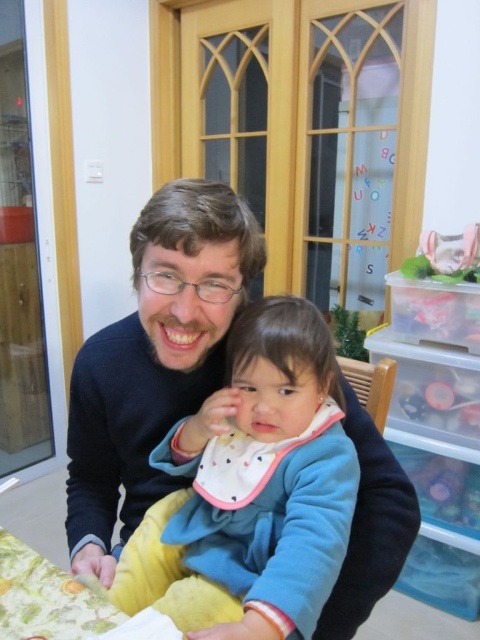
You are organizing a small party and need to place a decorative centerpiece on the table. Which object should you place it on, the blue fleece jacket at center or the floral fabric table at lower left?

The floral fabric table at lower left is the appropriate surface for placing the decorative centerpiece since the blue fleece jacket at center is positioned to the right of it, and tables are typically used for such items rather than clothing.

Based on the photo, you are organizing a small event and need to place a 1.2 meter wide tablecloth on the floral fabric table at lower left. Given the dimensions of the blue fleece jacket at center and the table, will the tablecloth fit properly on the table?

The blue fleece jacket at center is wider than the floral fabric table at lower left. Since the tablecloth is 1.2 meters wide, it will fit properly on the floral fabric table at lower left as long as the table is at least 1.2 meters wide. However, since the jacket is wider, the table might be narrower than the jacket, so the tablecloth should fit unless the table is narrower than 1.2 meters.

You are standing in the room where the father and child are sitting. You want to place a small decorative item between the two points, point (252, 481) and point (4, 564). Which point should the item be closer to in order to be in front of the other point?

The item should be closer to point (252, 481) because it is in front of point (4, 564).